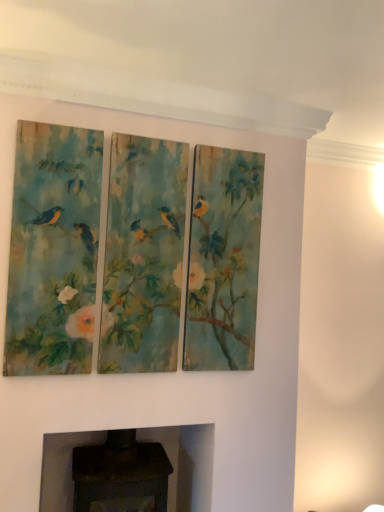
The image size is (384, 512). What do you see at coordinates (186, 463) in the screenshot?
I see `dark gray stone fireplace at lower center` at bounding box center [186, 463].

What is the approximate width of dark gray stone fireplace at lower center?

dark gray stone fireplace at lower center is 21.79 inches wide.

Locate an element on the screen. This screenshot has height=512, width=384. dark gray stone fireplace at lower center is located at coordinates (186, 463).

What are the coordinates of `textured canvas triptych at center` in the screenshot? It's located at (53, 251).

Describe the element at coordinates (53, 251) in the screenshot. I see `textured canvas triptych at center` at that location.

Where is `dark gray stone fireplace at lower center`? dark gray stone fireplace at lower center is located at coordinates (186, 463).

Considering the relative positions of dark gray stone fireplace at lower center and textured canvas triptych at center in the image provided, is dark gray stone fireplace at lower center to the right of textured canvas triptych at center from the viewer's perspective?

No.

Looking at this image, is dark gray stone fireplace at lower center in front of or behind textured canvas triptych at center in the image?

dark gray stone fireplace at lower center is positioned farther from the viewer than textured canvas triptych at center.

Between point (93, 434) and point (25, 248), which one is positioned behind?

The point (93, 434) is farther from the camera.

From the image's perspective, does dark gray stone fireplace at lower center appear higher than textured canvas triptych at center?

No, from the image's perspective, dark gray stone fireplace at lower center is not above textured canvas triptych at center.

From a real-world perspective, is dark gray stone fireplace at lower center above or below textured canvas triptych at center?

From a real-world perspective, dark gray stone fireplace at lower center is physically below textured canvas triptych at center.

Considering the relative sizes of dark gray stone fireplace at lower center and textured canvas triptych at center in the image provided, is dark gray stone fireplace at lower center thinner than textured canvas triptych at center?

In fact, dark gray stone fireplace at lower center might be wider than textured canvas triptych at center.

From their relative heights in the image, would you say dark gray stone fireplace at lower center is taller or shorter than textured canvas triptych at center?

Clearly, dark gray stone fireplace at lower center is shorter compared to textured canvas triptych at center.

Looking at this image, based on their sizes in the image, would you say dark gray stone fireplace at lower center is bigger or smaller than textured canvas triptych at center?

dark gray stone fireplace at lower center is bigger than textured canvas triptych at center.

Can textured canvas triptych at center be found inside dark gray stone fireplace at lower center?

No, textured canvas triptych at center is not surrounded by dark gray stone fireplace at lower center.

Is dark gray stone fireplace at lower center placed right next to textured canvas triptych at center?

There is a gap between dark gray stone fireplace at lower center and textured canvas triptych at center.

Does dark gray stone fireplace at lower center turn towards textured canvas triptych at center?

No, dark gray stone fireplace at lower center is not oriented towards textured canvas triptych at center.

Measure the distance between dark gray stone fireplace at lower center and textured canvas triptych at center.

They are 79.68 centimeters apart.

The width and height of the screenshot is (384, 512). Find the location of `oil painting that appears above the dark gray stone fireplace at lower center (from a real-world perspective)`. oil painting that appears above the dark gray stone fireplace at lower center (from a real-world perspective) is located at coordinates (53, 251).

Can you confirm if textured canvas triptych at center is positioned to the right of dark gray stone fireplace at lower center?

Correct, you'll find textured canvas triptych at center to the right of dark gray stone fireplace at lower center.

Considering the positions of objects textured canvas triptych at center and dark gray stone fireplace at lower center in the image provided, who is in front, textured canvas triptych at center or dark gray stone fireplace at lower center?

textured canvas triptych at center is closer to the camera.

Is point (54, 342) more distant than point (204, 501)?

No, it is not.

From the image's perspective, would you say textured canvas triptych at center is positioned over dark gray stone fireplace at lower center?

Yes.

From a real-world perspective, is textured canvas triptych at center on top of dark gray stone fireplace at lower center?

Yes, from a real-world perspective, textured canvas triptych at center is on top of dark gray stone fireplace at lower center.

Does textured canvas triptych at center have a greater width compared to dark gray stone fireplace at lower center?

No, textured canvas triptych at center is not wider than dark gray stone fireplace at lower center.

Considering the sizes of objects textured canvas triptych at center and dark gray stone fireplace at lower center in the image provided, who is taller, textured canvas triptych at center or dark gray stone fireplace at lower center?

textured canvas triptych at center.

Considering the relative sizes of textured canvas triptych at center and dark gray stone fireplace at lower center in the image provided, is textured canvas triptych at center smaller than dark gray stone fireplace at lower center?

Yes.

Is dark gray stone fireplace at lower center surrounded by textured canvas triptych at center?

That's incorrect, dark gray stone fireplace at lower center is not inside textured canvas triptych at center.

Are textured canvas triptych at center and dark gray stone fireplace at lower center making contact?

textured canvas triptych at center is not next to dark gray stone fireplace at lower center, and they're not touching.

Is textured canvas triptych at center positioned with its back to dark gray stone fireplace at lower center?

textured canvas triptych at center is not turned away from dark gray stone fireplace at lower center.

Could you measure the distance between textured canvas triptych at center and dark gray stone fireplace at lower center?

A distance of 31.37 inches exists between textured canvas triptych at center and dark gray stone fireplace at lower center.

Where is `fireplace lying behind the textured canvas triptych at center`? This screenshot has height=512, width=384. fireplace lying behind the textured canvas triptych at center is located at coordinates (186, 463).

At what (x,y) coordinates should I click in order to perform the action: click on oil painting in front of the dark gray stone fireplace at lower center. Please return your answer as a coordinate pair (x, y). This screenshot has height=512, width=384. Looking at the image, I should click on (53, 251).

In order to click on fireplace lying below the textured canvas triptych at center (from the image's perspective) in this screenshot , I will do `click(186, 463)`.